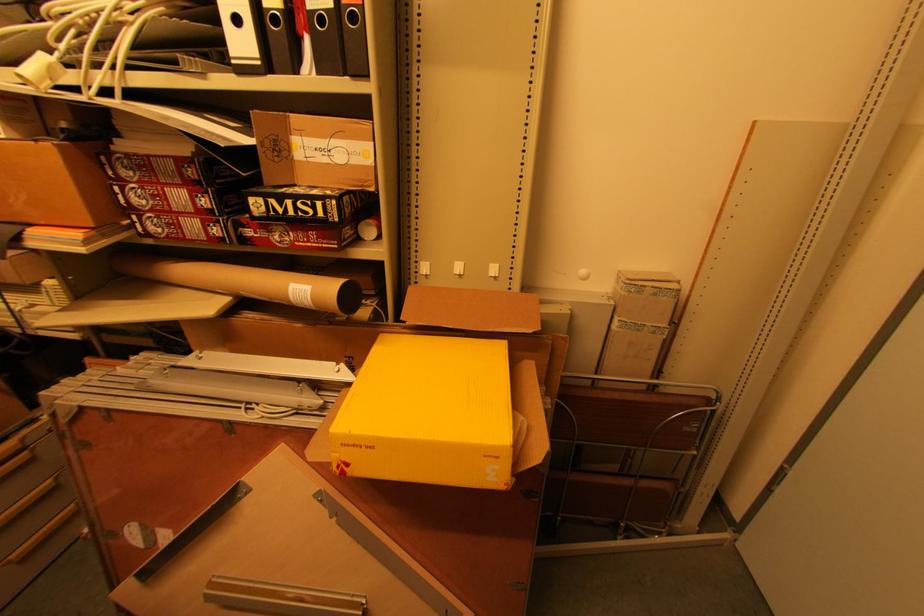
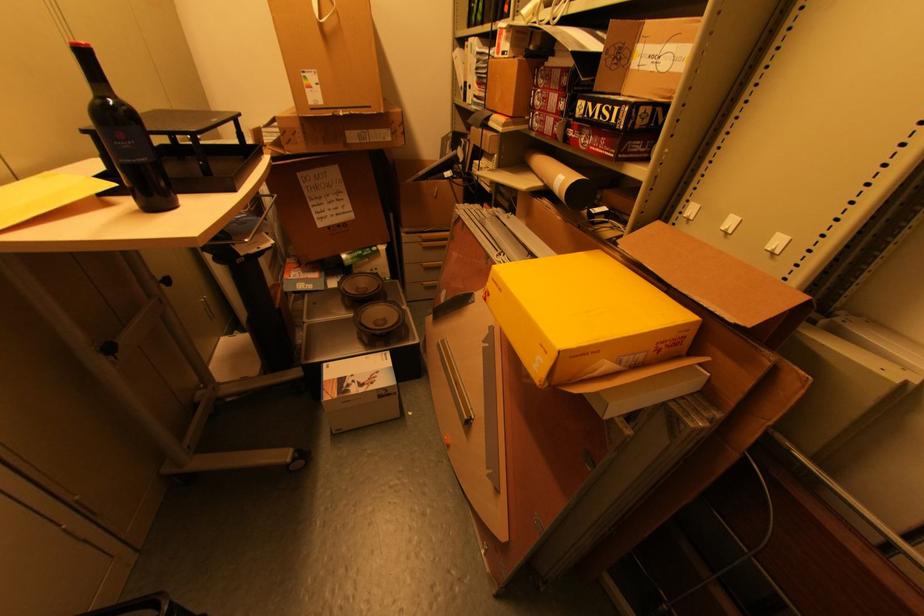
In the second image, find the point that corresponds to point (357, 447) in the first image.

(499, 284)